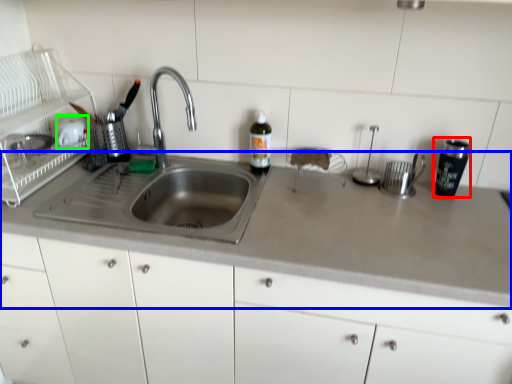
Question: Based on their relative distances, which object is nearer to tableware (highlighted by a red box)? Choose from countertop (highlighted by a blue box) and appliance (highlighted by a green box).

Choices:
 (A) countertop
 (B) appliance

Answer: (A)